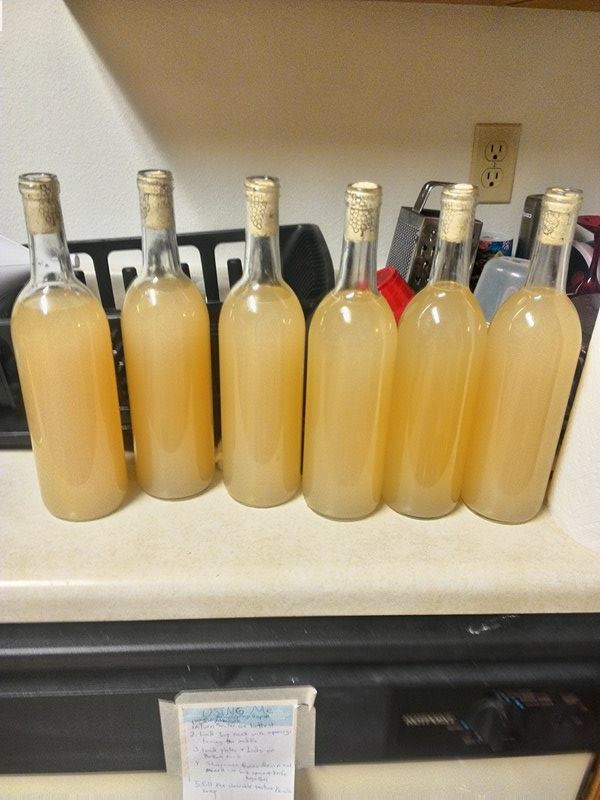
This screenshot has height=800, width=600. I want to click on white wall, so click(x=303, y=116).